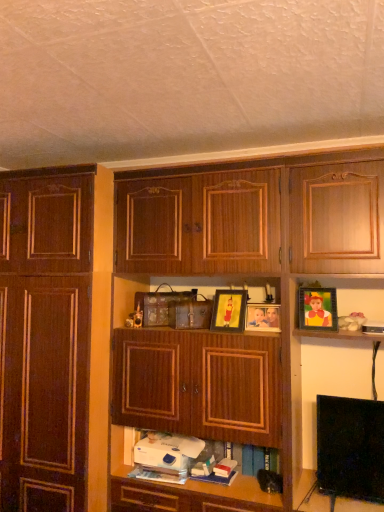
This screenshot has width=384, height=512. Identify the location of wooden cabinet at center, arranged as the second cabinetry when viewed from the left. (240, 276).

The width and height of the screenshot is (384, 512). What do you see at coordinates (240, 276) in the screenshot? I see `wooden cabinet at center, arranged as the second cabinetry when viewed from the left` at bounding box center [240, 276].

Describe the element at coordinates (224, 467) in the screenshot. The height and width of the screenshot is (512, 384). I see `white matte book at center, positioned as the 1th book in right-to-left order` at that location.

Identify the location of matte wooden picture frame at center, which ranks as the first picture frame in left-to-right order. This screenshot has width=384, height=512. (229, 310).

How much space does dark wood cabinet at left, acting as the 2th cabinetry starting from the right, occupy vertically?

The height of dark wood cabinet at left, acting as the 2th cabinetry starting from the right, is 7.02 feet.

In order to click on white matte book at lower center, the second book viewed from the right in this screenshot , I will do click(181, 457).

Based on the photo, in order to face white matte book at lower center, the 1th book from the left, should I rotate leftwards or rightwards?

You should rotate right by 2.965 degrees.

Find the location of a particular element. wooden photo frame at center, which is counted as the 2th picture frame, starting from the left is located at coordinates (263, 317).

Considering the sizes of objects wooden cabinet at center, arranged as the second cabinetry when viewed from the left, and white matte book at center, the second book in the left-to-right sequence, in the image provided, who is taller, wooden cabinet at center, arranged as the second cabinetry when viewed from the left, or white matte book at center, the second book in the left-to-right sequence,?

With more height is wooden cabinet at center, arranged as the second cabinetry when viewed from the left.

Is wooden cabinet at center, the 1th cabinetry from the right, in front of or behind white matte book at center, positioned as the 1th book in right-to-left order, in the image?

wooden cabinet at center, the 1th cabinetry from the right, is positioned closer to the viewer than white matte book at center, positioned as the 1th book in right-to-left order.

From the image's perspective, does wooden cabinet at center, the 1th cabinetry from the right, appear lower than white matte book at center, positioned as the 1th book in right-to-left order?

Actually, wooden cabinet at center, the 1th cabinetry from the right, appears above white matte book at center, positioned as the 1th book in right-to-left order, in the image.

Is wooden cabinet at center, the 1th cabinetry from the right, facing away from white matte book at center, the second book in the left-to-right sequence?

That's right, wooden cabinet at center, the 1th cabinetry from the right, is facing away from white matte book at center, the second book in the left-to-right sequence.

Does metallic gold picture frame at upper right, positioned as the 1th picture frame in right-to-left order, have a lesser height compared to white matte book at lower center, the second book viewed from the right?

No, metallic gold picture frame at upper right, positioned as the 1th picture frame in right-to-left order, is not shorter than white matte book at lower center, the second book viewed from the right.

Is metallic gold picture frame at upper right, positioned as the 1th picture frame in right-to-left order, facing towards white matte book at lower center, the second book viewed from the right?

No, metallic gold picture frame at upper right, positioned as the 1th picture frame in right-to-left order, does not turn towards white matte book at lower center, the second book viewed from the right.

In the scene shown: Does metallic gold picture frame at upper right, positioned as the 1th picture frame in right-to-left order, have a larger size compared to white matte book at lower center, the 1th book from the left?

Incorrect, metallic gold picture frame at upper right, positioned as the 1th picture frame in right-to-left order, is not larger than white matte book at lower center, the 1th book from the left.

Is point (229, 301) farther from camera compared to point (304, 307)?

Yes, point (229, 301) is behind point (304, 307).

Looking at this image, is matte wooden picture frame at center, acting as the third picture frame starting from the right, positioned in front of metallic gold picture frame at upper right, which is the 3th picture frame from left to right?

No, matte wooden picture frame at center, acting as the third picture frame starting from the right, is further to the viewer.

Is matte wooden picture frame at center, which ranks as the first picture frame in left-to-right order, directly adjacent to metallic gold picture frame at upper right, positioned as the 1th picture frame in right-to-left order?

No, matte wooden picture frame at center, which ranks as the first picture frame in left-to-right order, is not with metallic gold picture frame at upper right, positioned as the 1th picture frame in right-to-left order.

Is dark wood cabinet at left, the 1th cabinetry when ordered from left to right, next to matte wooden picture frame at center, which ranks as the first picture frame in left-to-right order, and touching it?

They are not placed beside each other.

Considering the relative sizes of dark wood cabinet at left, acting as the 2th cabinetry starting from the right, and matte wooden picture frame at center, acting as the third picture frame starting from the right, in the image provided, is dark wood cabinet at left, acting as the 2th cabinetry starting from the right, smaller than matte wooden picture frame at center, acting as the third picture frame starting from the right,?

No.

Could you tell me if dark wood cabinet at left, the 1th cabinetry when ordered from left to right, is turned towards matte wooden picture frame at center, acting as the third picture frame starting from the right?

No, dark wood cabinet at left, the 1th cabinetry when ordered from left to right, is not oriented towards matte wooden picture frame at center, acting as the third picture frame starting from the right.

Considering the positions of objects matte wooden picture frame at center, which ranks as the first picture frame in left-to-right order, and white matte book at lower center, the second book viewed from the right, in the image provided, who is more to the left, matte wooden picture frame at center, which ranks as the first picture frame in left-to-right order, or white matte book at lower center, the second book viewed from the right,?

white matte book at lower center, the second book viewed from the right, is more to the left.

Measure the distance from matte wooden picture frame at center, acting as the third picture frame starting from the right, to white matte book at lower center, the second book viewed from the right.

27.54 inches.

Between matte wooden picture frame at center, which ranks as the first picture frame in left-to-right order, and white matte book at lower center, the second book viewed from the right, which one has larger width?

white matte book at lower center, the second book viewed from the right.

Does matte wooden picture frame at center, acting as the third picture frame starting from the right, have a greater height compared to white matte book at lower center, the second book viewed from the right?

Indeed, matte wooden picture frame at center, acting as the third picture frame starting from the right, has a greater height compared to white matte book at lower center, the second book viewed from the right.

Which is closer, (308, 308) or (71, 338)?

The point (308, 308) is more forward.

The height and width of the screenshot is (512, 384). What are the coordinates of `picture frame that is the 3rd one above the dark wood cabinet at left, acting as the 2th cabinetry starting from the right (from a real-world perspective)` in the screenshot? It's located at (317, 308).

Is metallic gold picture frame at upper right, positioned as the 1th picture frame in right-to-left order, beside dark wood cabinet at left, the 1th cabinetry when ordered from left to right?

metallic gold picture frame at upper right, positioned as the 1th picture frame in right-to-left order, is not next to dark wood cabinet at left, the 1th cabinetry when ordered from left to right, and they're not touching.

From a real-world perspective, who is located lower, metallic gold picture frame at upper right, which is the 3th picture frame from left to right, or wooden cabinet at center, arranged as the second cabinetry when viewed from the left?

wooden cabinet at center, arranged as the second cabinetry when viewed from the left.

From the image's perspective, is metallic gold picture frame at upper right, which is the 3th picture frame from left to right, over wooden cabinet at center, the 1th cabinetry from the right?

Yes.

Can you confirm if metallic gold picture frame at upper right, positioned as the 1th picture frame in right-to-left order, is positioned to the right of wooden cabinet at center, arranged as the second cabinetry when viewed from the left?

Indeed, metallic gold picture frame at upper right, positioned as the 1th picture frame in right-to-left order, is positioned on the right side of wooden cabinet at center, arranged as the second cabinetry when viewed from the left.

Is point (304, 320) positioned behind point (191, 196)?

No, it is in front of (191, 196).

Identify the location of book that is the 2nd object located below the wooden cabinet at center, arranged as the second cabinetry when viewed from the left (from the image's perspective). The width and height of the screenshot is (384, 512). (224, 467).

Locate an element on the screen. the 1st book directly beneath the metallic gold picture frame at upper right, which is the 3th picture frame from left to right (from a real-world perspective) is located at coordinates (181, 457).

When comparing their distances from white matte book at center, the second book in the left-to-right sequence, does wooden photo frame at center, which is counted as the 2th picture frame, starting from the left, or wooden cabinet at center, the 1th cabinetry from the right, seem closer?

wooden photo frame at center, which is counted as the 2th picture frame, starting from the left.

When comparing their distances from wooden cabinet at center, the 1th cabinetry from the right, does metallic gold picture frame at upper right, which is the 3th picture frame from left to right, or white matte book at center, positioned as the 1th book in right-to-left order, seem further?

Based on the image, white matte book at center, positioned as the 1th book in right-to-left order, appears to be further to wooden cabinet at center, the 1th cabinetry from the right.

From the image, which object appears to be nearer to matte wooden picture frame at center, acting as the third picture frame starting from the right, white matte book at lower center, the 1th book from the left, or metallic gold picture frame at upper right, which is the 3th picture frame from left to right?

The object closer to matte wooden picture frame at center, acting as the third picture frame starting from the right, is metallic gold picture frame at upper right, which is the 3th picture frame from left to right.

Based on their spatial positions, is metallic gold picture frame at upper right, positioned as the 1th picture frame in right-to-left order, or white matte book at center, positioned as the 1th book in right-to-left order, further from white matte book at lower center, the second book viewed from the right?

The object further to white matte book at lower center, the second book viewed from the right, is metallic gold picture frame at upper right, positioned as the 1th picture frame in right-to-left order.

From the image, which object appears to be farther from matte wooden picture frame at center, which ranks as the first picture frame in left-to-right order, white matte book at lower center, the second book viewed from the right, or dark wood cabinet at left, acting as the 2th cabinetry starting from the right?

dark wood cabinet at left, acting as the 2th cabinetry starting from the right.

Based on their spatial positions, is matte wooden picture frame at center, acting as the third picture frame starting from the right, or wooden cabinet at center, the 1th cabinetry from the right, further from metallic gold picture frame at upper right, positioned as the 1th picture frame in right-to-left order?

Based on the image, wooden cabinet at center, the 1th cabinetry from the right, appears to be further to metallic gold picture frame at upper right, positioned as the 1th picture frame in right-to-left order.

Considering their positions, is matte wooden picture frame at center, which ranks as the first picture frame in left-to-right order, positioned further to white matte book at lower center, the second book viewed from the right, than metallic gold picture frame at upper right, which is the 3th picture frame from left to right?

metallic gold picture frame at upper right, which is the 3th picture frame from left to right, lies further to white matte book at lower center, the second book viewed from the right, than the other object.

Looking at the image, which one is located further to wooden cabinet at center, the 1th cabinetry from the right, white matte book at lower center, the 1th book from the left, or wooden photo frame at center, which is the 2th picture frame in right-to-left order?

wooden photo frame at center, which is the 2th picture frame in right-to-left order.

Locate an element on the screen. The image size is (384, 512). picture frame between matte wooden picture frame at center, acting as the third picture frame starting from the right, and white matte book at center, the second book in the left-to-right sequence, in the up-down direction is located at coordinates (263, 317).

Locate an element on the screen. cabinetry between matte wooden picture frame at center, acting as the third picture frame starting from the right, and metallic gold picture frame at upper right, which is the 3th picture frame from left to right, from left to right is located at coordinates (240, 276).

What are the coordinates of `book between wooden cabinet at center, arranged as the second cabinetry when viewed from the left, and white matte book at center, positioned as the 1th book in right-to-left order, in the up-down direction` in the screenshot? It's located at (181, 457).

This screenshot has width=384, height=512. I want to click on cabinetry situated between dark wood cabinet at left, the 1th cabinetry when ordered from left to right, and wooden photo frame at center, which is counted as the 2th picture frame, starting from the left, from left to right, so click(x=240, y=276).